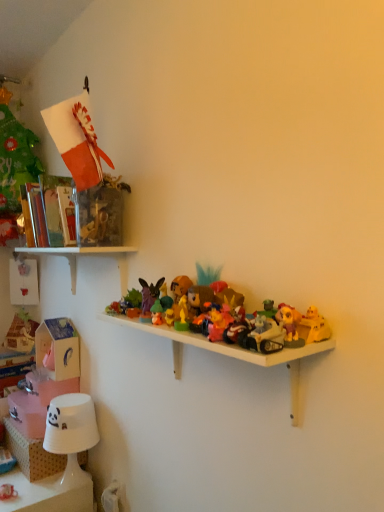
Question: Which is correct: white paper lampshade at lower left is inside matte plastic toy at center, placed as the eighth toy when sorted from bottom to top, or outside of it?

Choices:
 (A) inside
 (B) outside

Answer: (B)

Question: Does point (51, 399) appear closer or farther from the camera than point (201, 311)?

Choices:
 (A) farther
 (B) closer

Answer: (A)

Question: Estimate the real-world distances between objects in this image. Which object is farther from the white plastic shelf at center, which is counted as the 2th shelf, starting from the bottom?

Choices:
 (A) white paper lampshade at lower left
 (B) shiny plastic motorcycle at center, marked as the 3th toy in a bottom-to-top arrangement
 (C) white glossy lampshade at lower left, the 3th shelf in the top-to-bottom sequence
 (D) shiny plastic figure at center, arranged as the 7th toy when ordered from the bottom
 (E) white plastic shelf at upper left, which appears as the 1th shelf when viewed from the top

Answer: (C)

Question: Estimate the real-world distances between objects in this image. Which object is closer to the white glossy lampshade at lower left, the 3th shelf in the top-to-bottom sequence?

Choices:
 (A) white paper lampshade at lower left
 (B) smooth white lampshade at lower left, acting as the eighth toy starting from the right
 (C) matte plastic toy at center, acting as the 1th toy starting from the top
 (D) shiny plastic figure at center, arranged as the 7th toy when ordered from the bottom
 (E) white plastic shelf at upper left, marked as the 3th shelf in a bottom-to-top arrangement

Answer: (A)